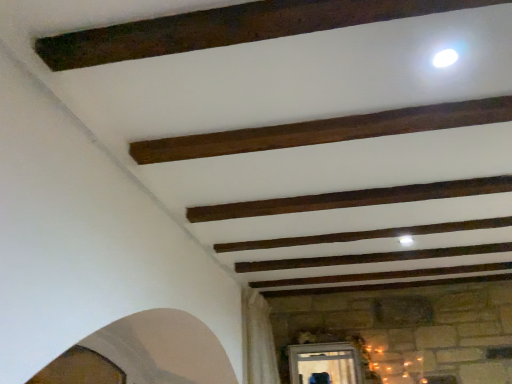
Question: Is dark brown wood plank at upper center, which is the 2th plank from bottom to top, inside the boundaries of dark brown wood plank at center, the 1th plank in the back-to-front sequence, or outside?

Choices:
 (A) inside
 (B) outside

Answer: (B)

Question: Is dark brown wood plank at upper center, acting as the 1th plank starting from the top, in front of or behind dark brown wood plank at center, the second plank viewed from the front, in the image?

Choices:
 (A) behind
 (B) front

Answer: (B)

Question: In terms of height, does dark brown wood plank at upper center, acting as the 1th plank starting from the top, look taller or shorter compared to dark brown wood plank at center, the 1th plank in the back-to-front sequence?

Choices:
 (A) short
 (B) tall

Answer: (A)

Question: Based on their sizes in the image, would you say dark brown wood plank at center, which appears as the 2th plank when viewed from the top, is bigger or smaller than dark brown wood plank at upper center, which is the 2th plank from bottom to top?

Choices:
 (A) small
 (B) big

Answer: (B)

Question: Would you say dark brown wood plank at center, the 1th plank in the back-to-front sequence, is to the left or to the right of dark brown wood plank at upper center, which is the 2th plank from bottom to top, in the picture?

Choices:
 (A) right
 (B) left

Answer: (A)

Question: From a real-world perspective, is dark brown wood plank at center, the 1th plank in the back-to-front sequence, physically located above or below dark brown wood plank at upper center, which is counted as the 1th plank, starting from the front?

Choices:
 (A) above
 (B) below

Answer: (B)

Question: Is dark brown wood plank at center, which appears as the 1th plank when ordered from the bottom, in front of or behind dark brown wood plank at upper center, which is counted as the 1th plank, starting from the front, in the image?

Choices:
 (A) behind
 (B) front

Answer: (A)